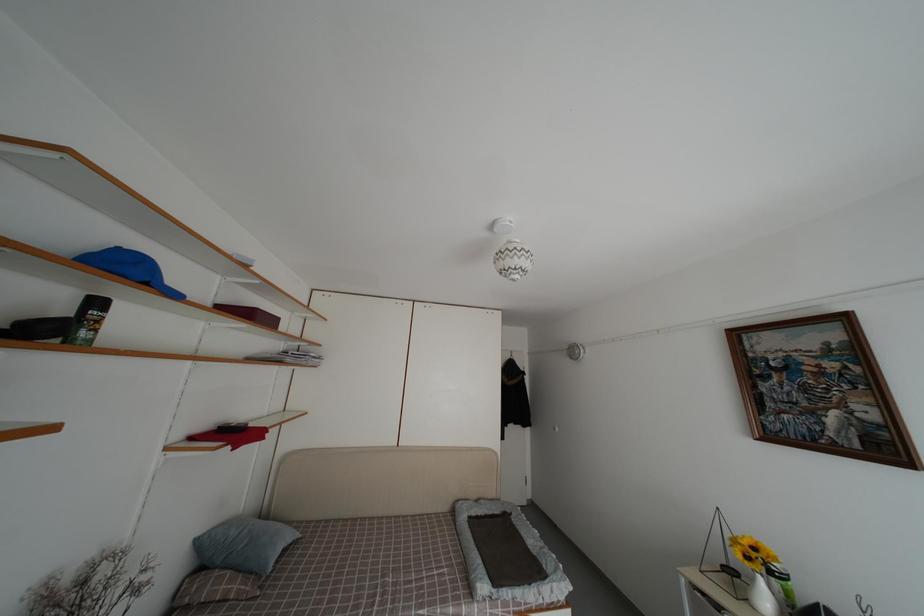
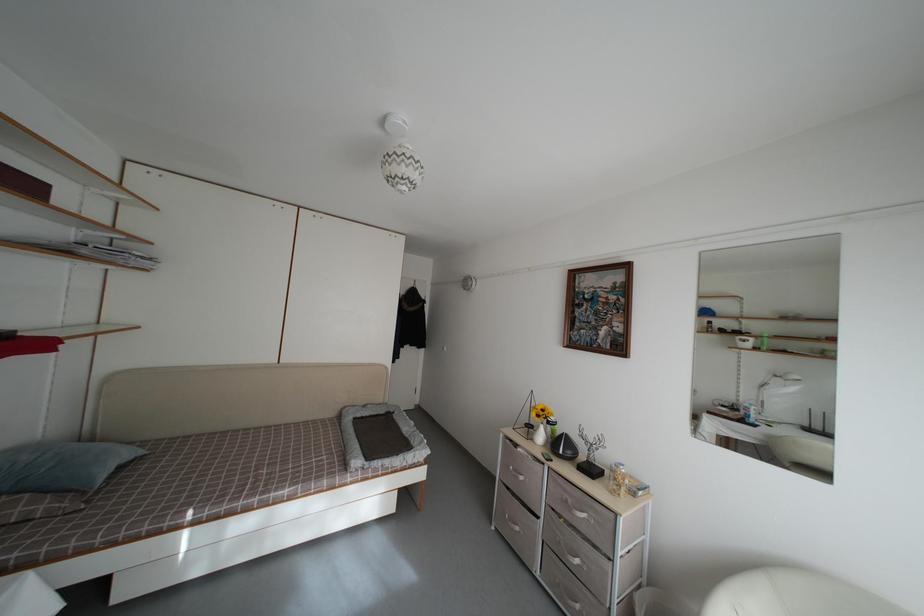
Question: The first image is from the beginning of the video and the second image is from the end. How did the camera likely rotate when shooting the video?

Choices:
 (A) Left
 (B) Right
 (C) Up
 (D) Down

Answer: (B)